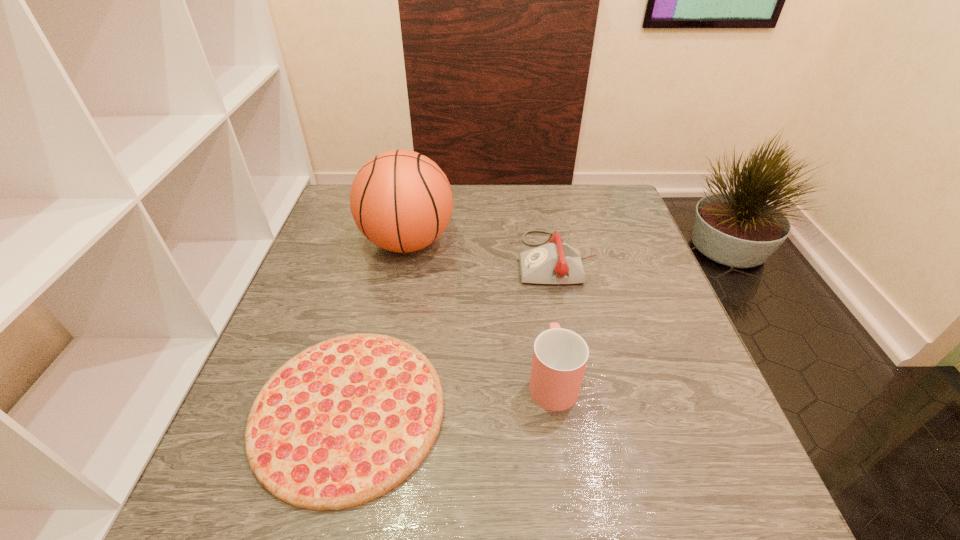
The width and height of the screenshot is (960, 540). In order to click on free area in between the tallest object and the telephone in this screenshot , I will do `click(483, 251)`.

Identify the location of free area in between the tallest object and the cup. This screenshot has height=540, width=960. (480, 311).

In order to click on empty space that is in between the cup and the basketball in this screenshot , I will do `click(480, 311)`.

Point out which object is positioned as the third nearest to the telephone. Please provide its 2D coordinates. Your answer should be formatted as a tuple, i.e. [(x, y)], where the tuple contains the x and y coordinates of a point satisfying the conditions above.

[(345, 421)]

In order to click on object that is the third closest to the basketball in this screenshot , I will do `click(560, 356)`.